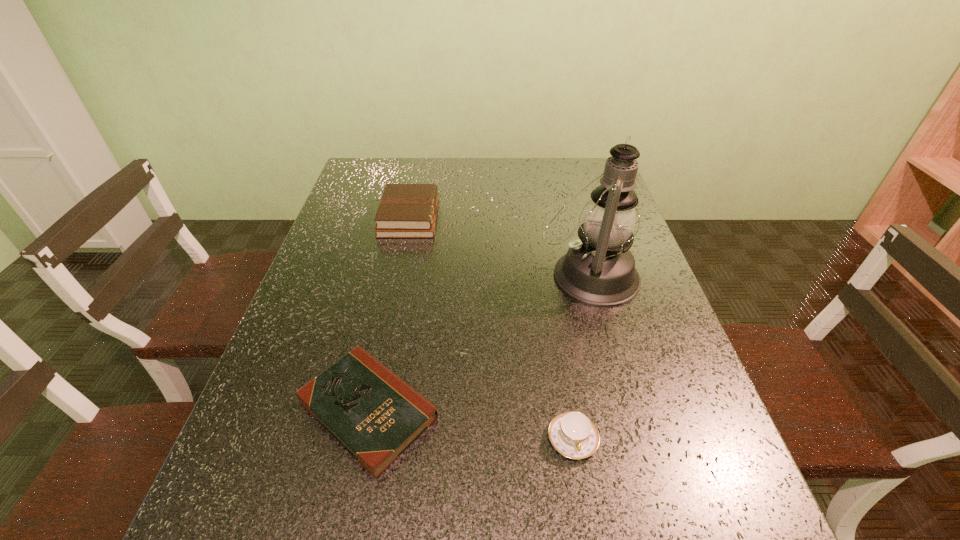
Locate an element on the screen. The height and width of the screenshot is (540, 960). free space between the third tallest object and the shorter Bible is located at coordinates (470, 424).

At what (x,y) coordinates should I click in order to perform the action: click on vacant area that lies between the farthest object and the tallest object. Please return your answer as a coordinate pair (x, y). Looking at the image, I should click on (499, 246).

Find the location of `free space between the tallest object and the third tallest object`. free space between the tallest object and the third tallest object is located at coordinates (581, 357).

Where is `vacant region between the second shortest object and the taller Bible`? This screenshot has height=540, width=960. vacant region between the second shortest object and the taller Bible is located at coordinates (491, 328).

Locate an element on the screen. The height and width of the screenshot is (540, 960). free space between the farther Bible and the oil lamp is located at coordinates (499, 246).

This screenshot has width=960, height=540. I want to click on empty location between the farther Bible and the tallest object, so click(x=499, y=246).

At what (x,y) coordinates should I click in order to perform the action: click on vacant space in between the oil lamp and the shorter Bible. Please return your answer as a coordinate pair (x, y). Image resolution: width=960 pixels, height=540 pixels. Looking at the image, I should click on (479, 342).

Point out which object is positioned as the second nearest to the third tallest object. Please provide its 2D coordinates. Your answer should be formatted as a tuple, i.e. [(x, y)], where the tuple contains the x and y coordinates of a point satisfying the conditions above.

[(599, 270)]

Where is `the second closest object relative to the oil lamp`? The height and width of the screenshot is (540, 960). the second closest object relative to the oil lamp is located at coordinates (405, 210).

Find the location of a particular element. free spot that satisfies the following two spatial constraints: 1. on the back side of the tallest object; 2. on the left side of the nearer Bible is located at coordinates (396, 275).